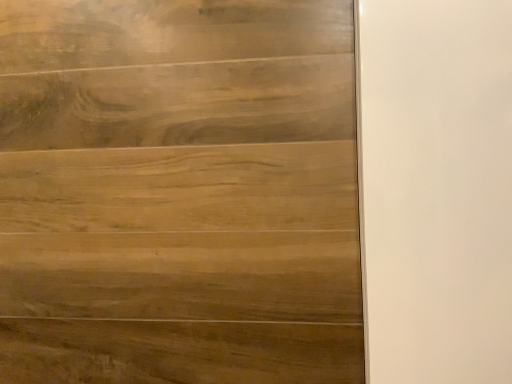
What is the approximate width of white glossy door at right?

white glossy door at right is 16.85 inches in width.

What do you see at coordinates (436, 189) in the screenshot? I see `white glossy door at right` at bounding box center [436, 189].

At what (x,y) coordinates should I click in order to perform the action: click on white glossy door at right. Please return your answer as a coordinate pair (x, y). Looking at the image, I should click on (436, 189).

Locate an element on the screen. This screenshot has height=384, width=512. white glossy door at right is located at coordinates (436, 189).